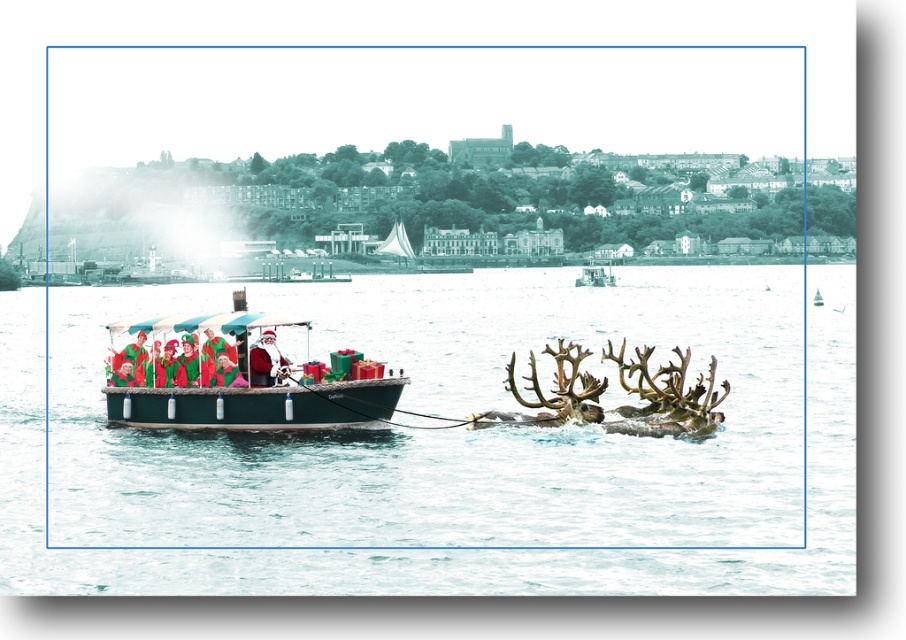
You are organizing a Christmas boat parade and need to decide which boat to place closer to the front for better visibility. Considering the green matte boat at center and the metallic green boat at center, which one should you choose based on their sizes?

The green matte boat at center has a larger width than the metallic green boat at center, so it should be placed closer to the front for better visibility.

You are organizing a Christmas boat parade and need to decide which boat to place closer to the front. The green matte boat at center and the metallic green boat at center are both available. Based on their sizes, which boat should be positioned closer to the front to ensure visibility?

The metallic green boat at center is larger in size compared to the green matte boat at center, so positioning the metallic green boat at center closer to the front will ensure better visibility for the audience.

You are a delivery drone that needs to land on the metallic green boat at center. The drone requires a landing area that is at least as wide as the boat itself. Can the clear water at boat center provide sufficient width for the drone to land safely?

The clear water at boat center might be wider than metallic green boat at center, so it could provide enough space for the drone to land safely as long as the width of the water is sufficient.